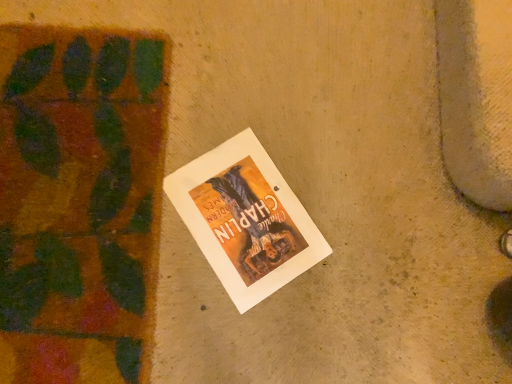
Locate an element on the screen. This screenshot has height=384, width=512. empty space that is ontop of green leafy plant at left (from a real-world perspective) is located at coordinates (61, 185).